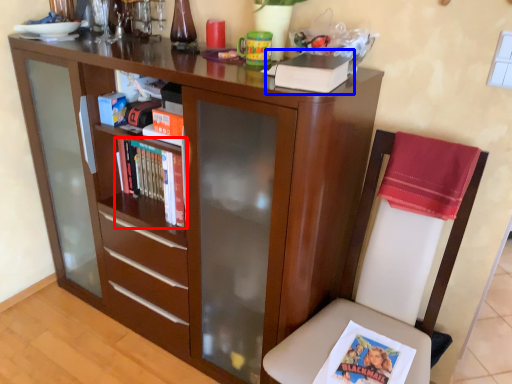
Question: Which of the following is the farthest to the observer, book (highlighted by a red box) or paperback book (highlighted by a blue box)?

Choices:
 (A) book
 (B) paperback book

Answer: (A)